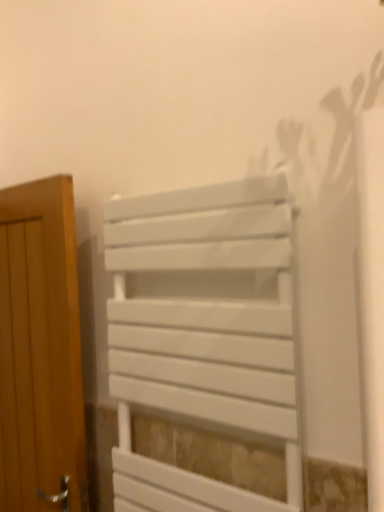
Describe the element at coordinates (203, 330) in the screenshot. The width and height of the screenshot is (384, 512). I see `white matte radiator at center` at that location.

Locate an element on the screen. The image size is (384, 512). white matte radiator at center is located at coordinates (203, 330).

What do you see at coordinates (40, 350) in the screenshot? The width and height of the screenshot is (384, 512). I see `wooden door at left` at bounding box center [40, 350].

Looking at this image, in order to face wooden door at left, should I rotate leftwards or rightwards?

To align with it, rotate left about 21.925°.

Where is `wooden door at left`? Image resolution: width=384 pixels, height=512 pixels. wooden door at left is located at coordinates (40, 350).

Measure the distance between wooden door at left and camera.

1.33 meters.

Where is `white matte radiator at center`? white matte radiator at center is located at coordinates [203, 330].

Can you confirm if wooden door at left is positioned to the right of white matte radiator at center?

No, wooden door at left is not to the right of white matte radiator at center.

Is the position of wooden door at left less distant than that of white matte radiator at center?

No, it is not.

Which is behind, point (36, 204) or point (188, 207)?

The point (36, 204) is more distant.

From the image's perspective, who appears lower, wooden door at left or white matte radiator at center?

wooden door at left, from the image's perspective.

From a real-world perspective, relative to white matte radiator at center, is wooden door at left vertically above or below?

wooden door at left is below white matte radiator at center.

Which object is wider, wooden door at left or white matte radiator at center?

With larger width is wooden door at left.

Consider the image. From their relative heights in the image, would you say wooden door at left is taller or shorter than white matte radiator at center?

In the image, wooden door at left appears to be taller than white matte radiator at center.

Is wooden door at left bigger than white matte radiator at center?

Yes, wooden door at left is bigger than white matte radiator at center.

Which is correct: wooden door at left is inside white matte radiator at center, or outside of it?

wooden door at left lies outside white matte radiator at center.

Is wooden door at left placed right next to white matte radiator at center?

No, wooden door at left is not touching white matte radiator at center.

Is wooden door at left turned away from white matte radiator at center?

No, wooden door at left is not facing the opposite direction of white matte radiator at center.

How different are the orientations of wooden door at left and white matte radiator at center in degrees?

The angle between the facing direction of wooden door at left and the facing direction of white matte radiator at center is 2.87 degrees.

How much distance is there between wooden door at left and white matte radiator at center?

wooden door at left is 39.32 centimeters away from white matte radiator at center.

Find the location of a particular element. The height and width of the screenshot is (512, 384). furniture that is above the wooden door at left (from a real-world perspective) is located at coordinates (203, 330).

From the picture: Which object is positioned more to the left, white matte radiator at center or wooden door at left?

Positioned to the left is wooden door at left.

Does white matte radiator at center come behind wooden door at left?

No, white matte radiator at center is closer to the camera.

Is point (236, 392) closer or farther from the camera than point (18, 355)?

Point (236, 392).

From the image's perspective, is white matte radiator at center beneath wooden door at left?

No, from the image's perspective, white matte radiator at center is not below wooden door at left.

From a real-world perspective, who is located lower, white matte radiator at center or wooden door at left?

wooden door at left, from a real-world perspective.

Considering the sizes of white matte radiator at center and wooden door at left in the image, is white matte radiator at center wider or thinner than wooden door at left?

white matte radiator at center is thinner than wooden door at left.

Considering the sizes of objects white matte radiator at center and wooden door at left in the image provided, who is shorter, white matte radiator at center or wooden door at left?

Standing shorter between the two is white matte radiator at center.

Looking at the image, does white matte radiator at center seem bigger or smaller compared to wooden door at left?

white matte radiator at center is smaller than wooden door at left.

Which is correct: white matte radiator at center is inside wooden door at left, or outside of it?

white matte radiator at center cannot be found inside wooden door at left.

Is there a large distance between white matte radiator at center and wooden door at left?

No.

Is wooden door at left at the back of white matte radiator at center?

white matte radiator at center is not turned away from wooden door at left.

Can you tell me how much white matte radiator at center and wooden door at left differ in facing direction?

The facing directions of white matte radiator at center and wooden door at left are 2.87 degrees apart.

Locate an element on the screen. The image size is (384, 512). furniture that appears on the right of wooden door at left is located at coordinates (203, 330).

This screenshot has height=512, width=384. I want to click on furniture in front of the wooden door at left, so click(x=203, y=330).

Locate an element on the screen. furniture on the right of wooden door at left is located at coordinates (203, 330).